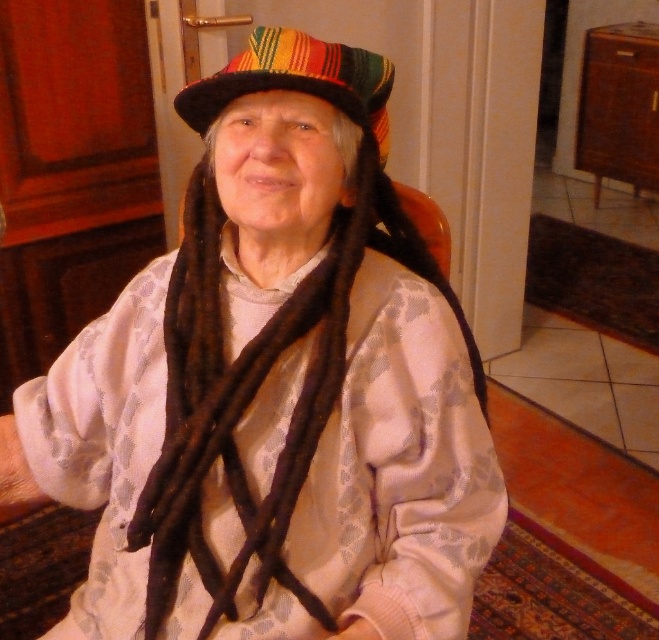
In the scene shown: Which of these two, multicolored fabric hat at upper center or striped fabric hat at upper center, stands shorter?

striped fabric hat at upper center

Where is `multicolored fabric hat at upper center`? This screenshot has height=640, width=659. multicolored fabric hat at upper center is located at coordinates (277, 387).

Identify the location of multicolored fabric hat at upper center. This screenshot has width=659, height=640. (277, 387).